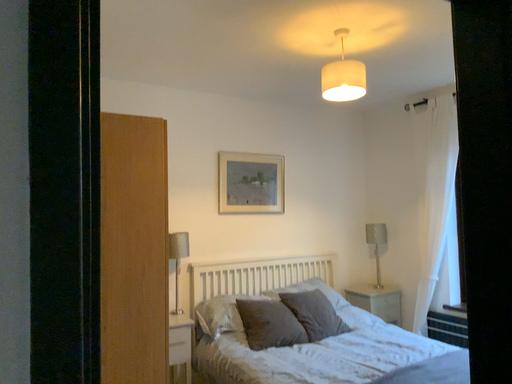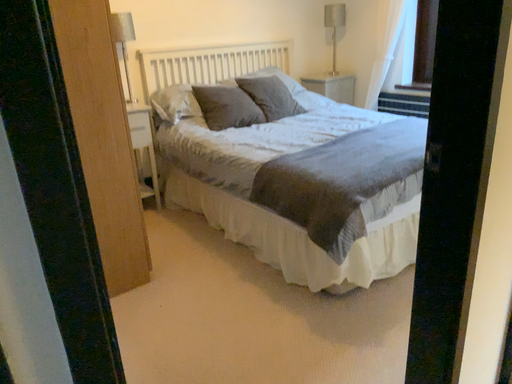
Question: Which way did the camera rotate in the video?

Choices:
 (A) rotated upward
 (B) rotated downward

Answer: (B)